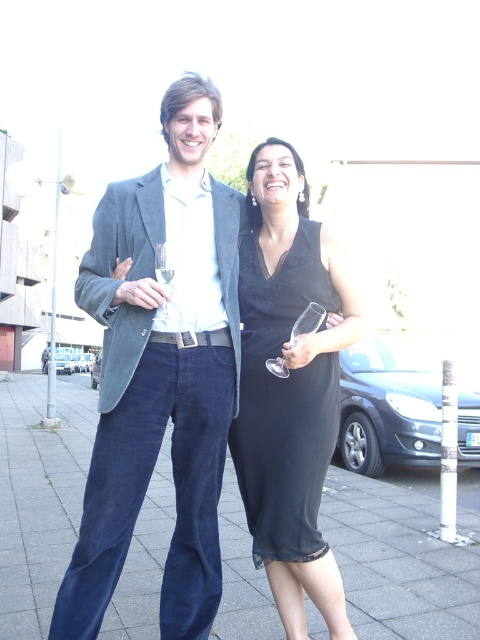
Question: Among these objects, which one is farthest from the camera?

Choices:
 (A) black satin dress at center
 (B) dark blue concrete pavement at lower center
 (C) matte gray blazer at center
 (D) matte glass wine glass at center

Answer: (A)

Question: Is dark blue concrete pavement at lower center to the right of clear glass wine glass at center from the viewer's perspective?

Choices:
 (A) no
 (B) yes

Answer: (A)

Question: Among these objects, which one is nearest to the camera?

Choices:
 (A) black satin dress at center
 (B) matte gray blazer at center
 (C) clear glass wine glass at center
 (D) matte glass wine glass at center

Answer: (B)

Question: Considering the relative positions of matte gray blazer at center and black satin dress at center in the image provided, where is matte gray blazer at center located with respect to black satin dress at center?

Choices:
 (A) above
 (B) below

Answer: (A)

Question: Can you confirm if matte gray blazer at center is bigger than black satin dress at center?

Choices:
 (A) no
 (B) yes

Answer: (B)

Question: Which of these objects is positioned farthest from the dark blue concrete pavement at lower center?

Choices:
 (A) matte gray blazer at center
 (B) black satin dress at center
 (C) clear glass wine glass at center

Answer: (C)